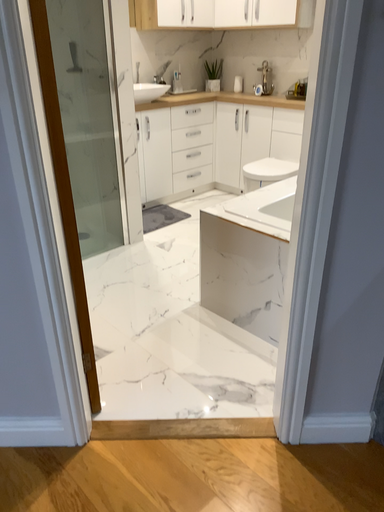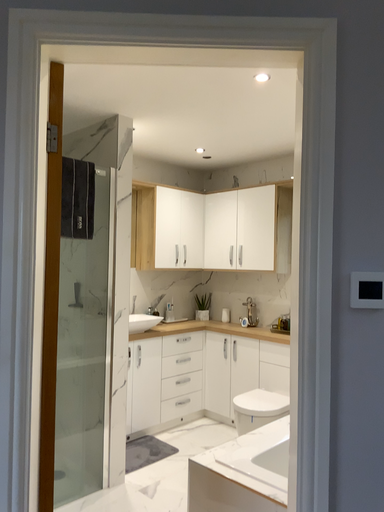
Question: Which way did the camera rotate in the video?

Choices:
 (A) rotated downward
 (B) rotated upward

Answer: (B)